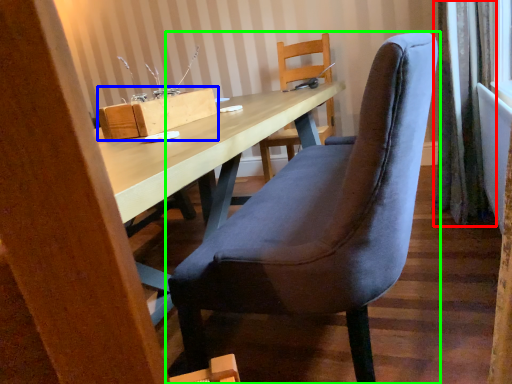
Question: Based on their relative distances, which object is nearer to curtain (highlighted by a red box)? Choose from cardboard box (highlighted by a blue box) and chair (highlighted by a green box).

Choices:
 (A) cardboard box
 (B) chair

Answer: (B)